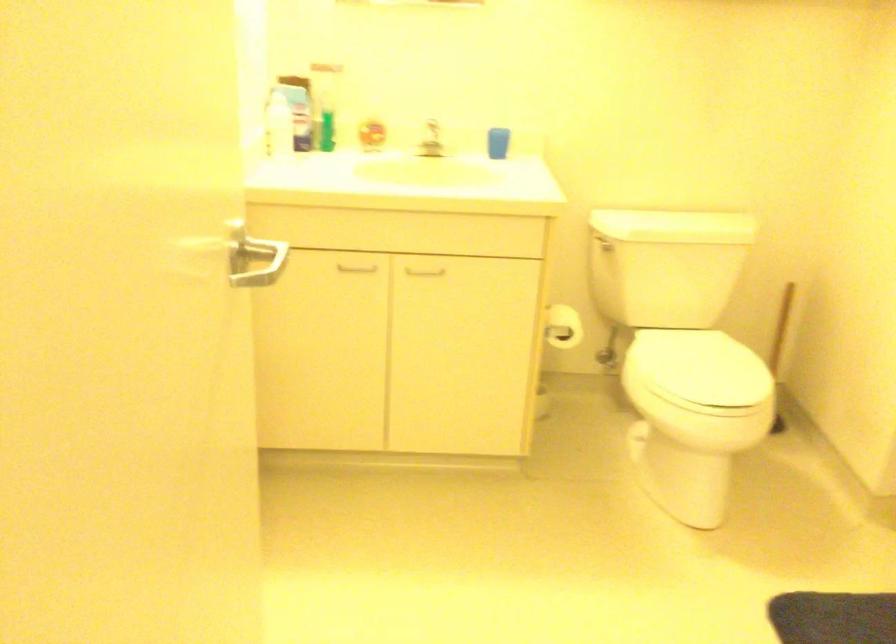
This screenshot has width=896, height=644. Describe the element at coordinates (780, 328) in the screenshot. I see `a toilet plunger handle` at that location.